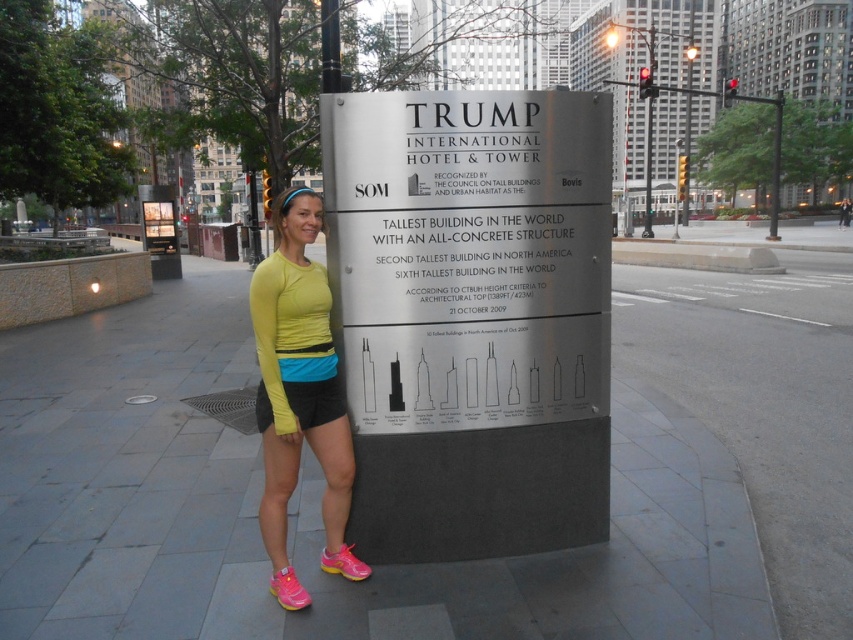
Is silver metallic sign at center further to the viewer compared to black fabric shorts at center?

Yes, silver metallic sign at center is further from the viewer.

Is silver metallic sign at center closer to camera compared to black fabric shorts at center?

No, it is not.

Between point (587, 269) and point (305, 397), which one is positioned behind?

The point (587, 269) is more distant.

Find the location of a particular element. This screenshot has width=853, height=640. silver metallic sign at center is located at coordinates (471, 317).

Is yellow matte long-sleeve shirt at center to the left of black fabric shorts at center from the viewer's perspective?

Yes, yellow matte long-sleeve shirt at center is to the left of black fabric shorts at center.

Which is more to the left, yellow matte long-sleeve shirt at center or black fabric shorts at center?

yellow matte long-sleeve shirt at center is more to the left.

Is point (279, 332) more distant than point (302, 426)?

No, (279, 332) is closer to viewer.

At what (x,y) coordinates should I click in order to perform the action: click on yellow matte long-sleeve shirt at center. Please return your answer as a coordinate pair (x, y). The width and height of the screenshot is (853, 640). Looking at the image, I should click on (299, 394).

Is metallic streetlight at upper right thinner than metallic pole at upper center?

No, metallic streetlight at upper right is not thinner than metallic pole at upper center.

What do you see at coordinates (634, 58) in the screenshot?
I see `metallic streetlight at upper right` at bounding box center [634, 58].

Which is in front, point (624, 170) or point (685, 84)?

Point (624, 170) is in front.

This screenshot has width=853, height=640. Identify the location of metallic streetlight at upper right. (634, 58).